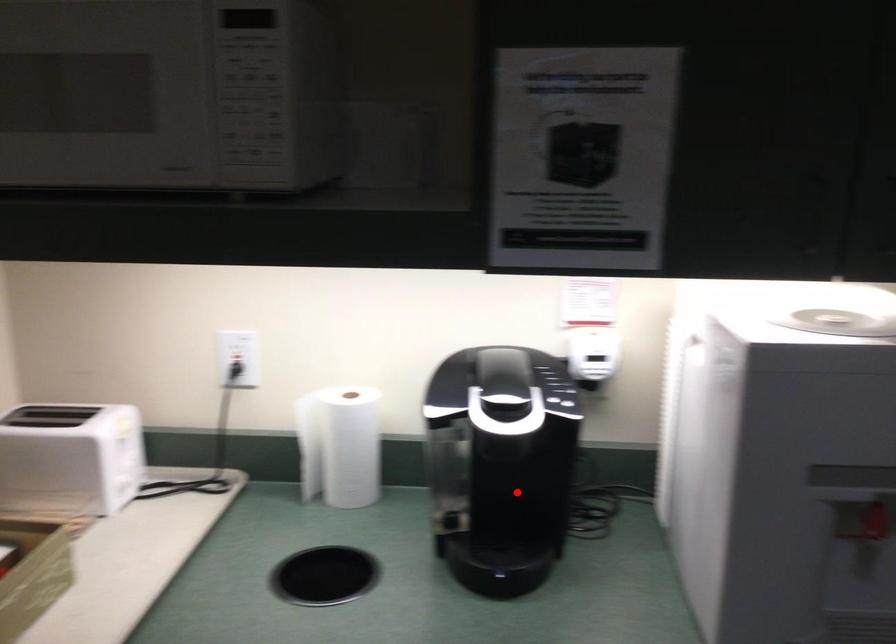
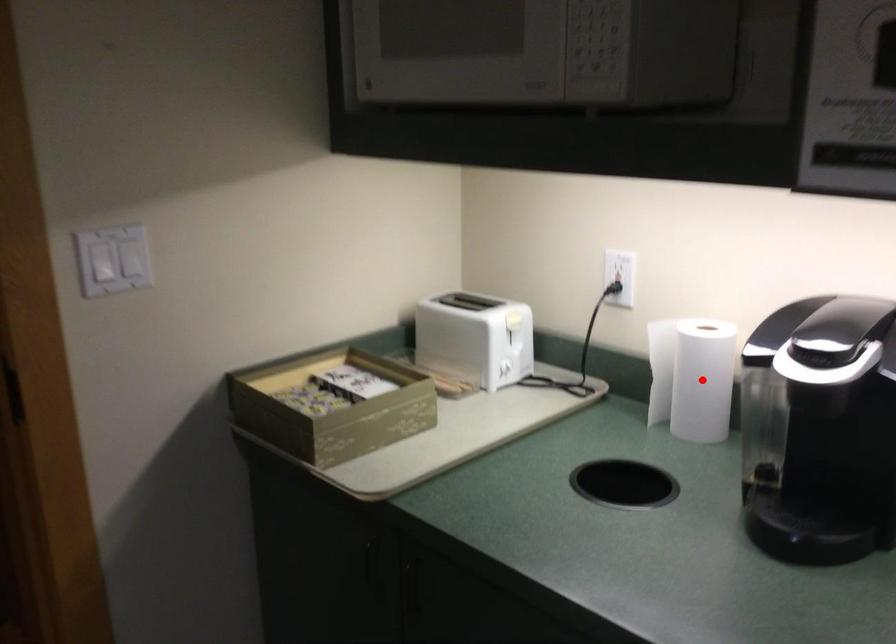
I am providing you with two images of the same scene from different viewpoints. A red point is marked on the first image and another point is marked on the second image. Is the marked point in image1 the same physical position as the marked point in image2?

No